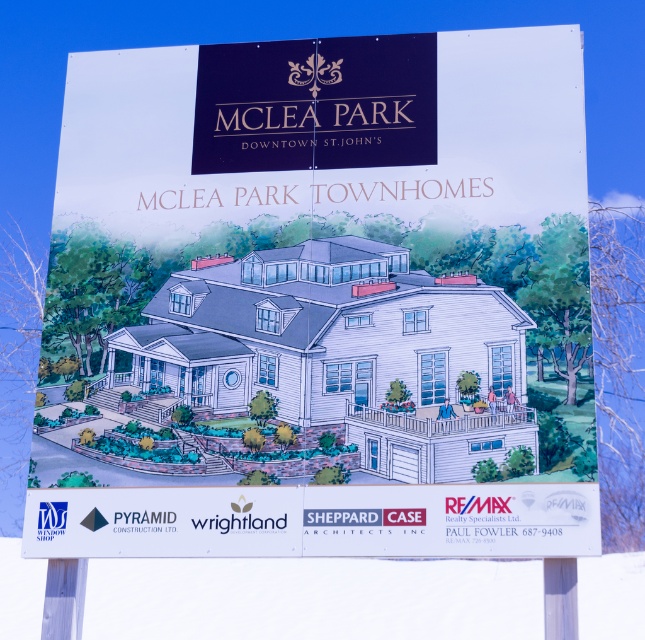
You are standing in front of the McLear Park Townhomes promotional sign. You notice a wooden post at lower left and a white plastic pole at lower right. Which object is closer to you?

The wooden post at lower left is closer to you because the white plastic pole at lower right is behind it.

You are standing in front of the McLear Park Townhomes promotional sign. There are two points marked on the sign at coordinates point [72,600] and point [546,577]. Which point is closer to you?

Point [72,600] is further to the viewer than point [546,577], so the point closer to you is point [546,577].